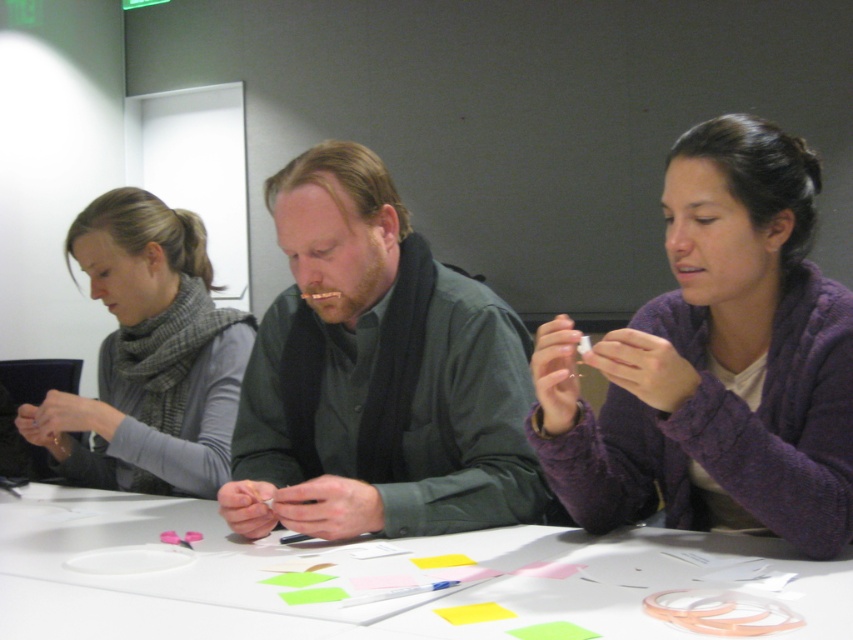
Question: Estimate the real-world distances between objects in this image. Which object is closer to the green matte shirt at center?

Choices:
 (A) gray wool scarf at left
 (B) white paper at center
 (C) purple fuzzy sweater at center

Answer: (B)

Question: Does purple fuzzy sweater at center come in front of gray wool scarf at left?

Choices:
 (A) no
 (B) yes

Answer: (B)

Question: Which point appears farthest from the camera in this image?

Choices:
 (A) (515, 344)
 (B) (109, 426)

Answer: (B)

Question: Which point is closer to the camera?

Choices:
 (A) purple fuzzy sweater at center
 (B) green matte shirt at center

Answer: (A)

Question: Is white paper at center smaller than gray wool scarf at left?

Choices:
 (A) no
 (B) yes

Answer: (B)

Question: Where is green matte shirt at center located in relation to white paper at center in the image?

Choices:
 (A) above
 (B) below

Answer: (A)